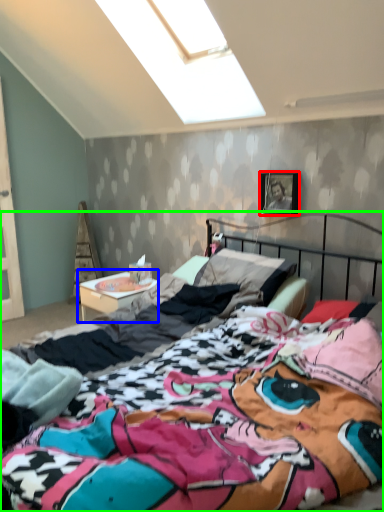
Question: Which object is positioned closest to picture frame (highlighted by a red box)? Select from nightstand (highlighted by a blue box) and bed (highlighted by a green box).

Choices:
 (A) nightstand
 (B) bed

Answer: (A)